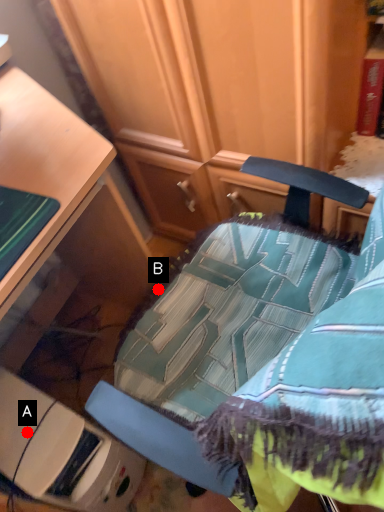
Question: Two points are circled on the image, labeled by A and B beside each circle. Which point is closer to the camera?

Choices:
 (A) A is closer
 (B) B is closer

Answer: (A)